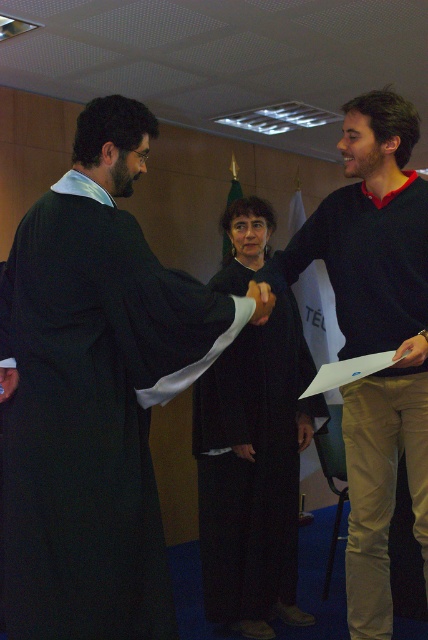
Question: Which of the following is the closest to the observer?

Choices:
 (A) matte black robe at left
 (B) black matte sweater at right

Answer: (A)

Question: Which point appears farthest from the camera in this image?

Choices:
 (A) (44, 512)
 (B) (377, 125)

Answer: (B)

Question: Does matte black robe at left have a smaller size compared to black matte robe at center?

Choices:
 (A) yes
 (B) no

Answer: (A)

Question: Which is nearer to the black matte robe at center?

Choices:
 (A) black matte sweater at right
 (B) matte black robe at left

Answer: (A)

Question: Does matte black robe at left have a smaller size compared to black matte robe at center?

Choices:
 (A) no
 (B) yes

Answer: (B)

Question: Does black matte sweater at right appear over black matte robe at center?

Choices:
 (A) yes
 (B) no

Answer: (A)